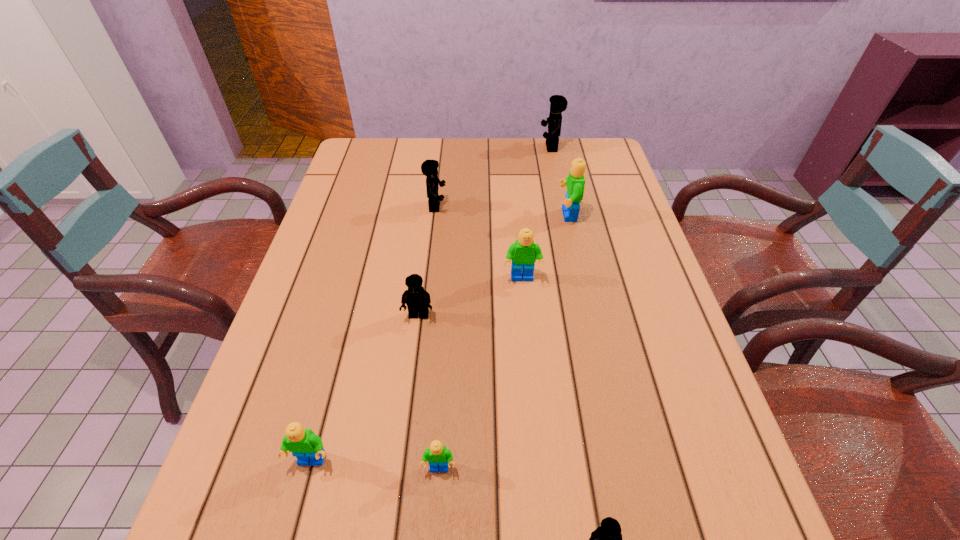
The image size is (960, 540). Find the location of `vacant position in the image that satisfies the following two spatial constraints: 1. on the face of the biggest green Lego; 2. on the face of the smallest green Lego`. vacant position in the image that satisfies the following two spatial constraints: 1. on the face of the biggest green Lego; 2. on the face of the smallest green Lego is located at coordinates (623, 469).

Find the location of a particular element. The width and height of the screenshot is (960, 540). vacant area that satisfies the following two spatial constraints: 1. on the front-facing side of the farthest Lego; 2. on the face of the leftmost object is located at coordinates (618, 461).

Locate an element on the screen. free spot that satisfies the following two spatial constraints: 1. on the face of the biggest green Lego; 2. on the face of the smallest green Lego is located at coordinates pos(623,469).